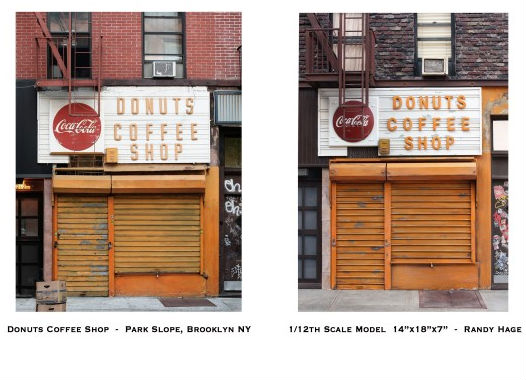
Identify the location of boxes. This screenshot has height=380, width=526. (50, 291).